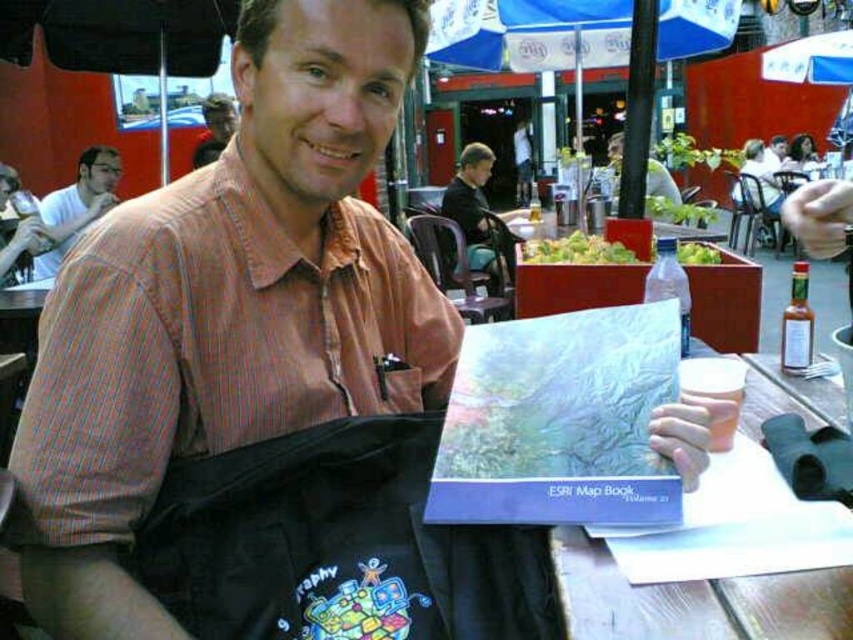
Is green leafy vegetables at center taller than smooth brown shirt at upper left?

Incorrect, green leafy vegetables at center's height is not larger of smooth brown shirt at upper left's.

Between green leafy vegetables at center and smooth brown shirt at upper left, which one appears on the right side from the viewer's perspective?

green leafy vegetables at center is more to the right.

Describe the element at coordinates (576, 250) in the screenshot. I see `green leafy vegetables at center` at that location.

This screenshot has width=853, height=640. I want to click on green leafy vegetables at center, so click(576, 250).

Between white paper at center and matte orange shirt at center, which one appears on the left side from the viewer's perspective?

Positioned to the left is white paper at center.

Between white paper at center and matte orange shirt at center, which one is positioned lower?

white paper at center is below.

What do you see at coordinates (695, 600) in the screenshot?
I see `white paper at center` at bounding box center [695, 600].

Locate an element on the screen. white paper at center is located at coordinates (695, 600).

Is dark brown leather jacket at center wider than green leafy vegetables at center?

No.

Between dark brown leather jacket at center and green leafy vegetables at center, which one appears on the right side from the viewer's perspective?

From the viewer's perspective, green leafy vegetables at center appears more on the right side.

Who is more distant from viewer, (457,198) or (698,259)?

The point (457,198) is behind.

Identify the location of dark brown leather jacket at center. This screenshot has height=640, width=853. (477, 216).